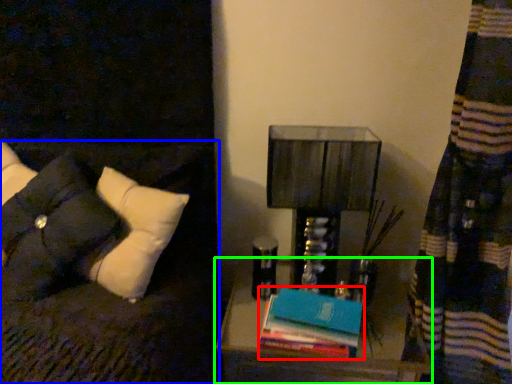
Question: Which is farther away from book (highlighted by a red box)? furniture (highlighted by a blue box) or nightstand (highlighted by a green box)?

Choices:
 (A) furniture
 (B) nightstand

Answer: (A)